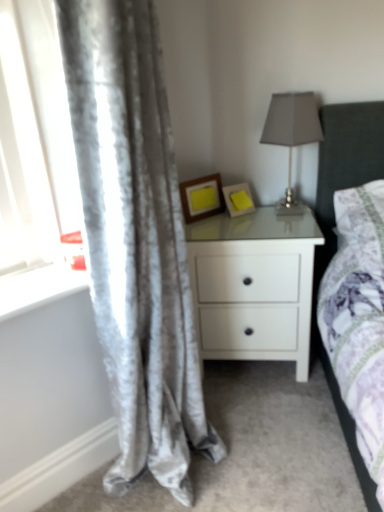
Question: From the image's perspective, is white glossy nightstand at center on white glossy window sill at lower left?

Choices:
 (A) no
 (B) yes

Answer: (A)

Question: Does white glossy nightstand at center have a greater width compared to white glossy window sill at lower left?

Choices:
 (A) no
 (B) yes

Answer: (B)

Question: Is white glossy nightstand at center oriented towards white glossy window sill at lower left?

Choices:
 (A) no
 (B) yes

Answer: (A)

Question: Is white glossy nightstand at center facing away from white glossy window sill at lower left?

Choices:
 (A) no
 (B) yes

Answer: (A)

Question: Is white glossy nightstand at center shorter than white glossy window sill at lower left?

Choices:
 (A) yes
 (B) no

Answer: (B)

Question: Is white glossy nightstand at center with white glossy window sill at lower left?

Choices:
 (A) no
 (B) yes

Answer: (A)

Question: Considering the relative sizes of yellow matte picture frame at upper center, which ranks as the first picture frame in right-to-left order, and white glossy window sill at lower left in the image provided, is yellow matte picture frame at upper center, which ranks as the first picture frame in right-to-left order, thinner than white glossy window sill at lower left?

Choices:
 (A) no
 (B) yes

Answer: (B)

Question: Could you tell me if yellow matte picture frame at upper center, placed as the second picture frame when sorted from left to right, is facing white glossy window sill at lower left?

Choices:
 (A) yes
 (B) no

Answer: (B)

Question: Does yellow matte picture frame at upper center, placed as the second picture frame when sorted from left to right, appear on the right side of white glossy window sill at lower left?

Choices:
 (A) no
 (B) yes

Answer: (B)

Question: From a real-world perspective, is yellow matte picture frame at upper center, which ranks as the first picture frame in right-to-left order, over white glossy window sill at lower left?

Choices:
 (A) yes
 (B) no

Answer: (A)

Question: Considering the relative sizes of yellow matte picture frame at upper center, which ranks as the first picture frame in right-to-left order, and white glossy window sill at lower left in the image provided, is yellow matte picture frame at upper center, which ranks as the first picture frame in right-to-left order, shorter than white glossy window sill at lower left?

Choices:
 (A) no
 (B) yes

Answer: (A)

Question: Is yellow matte picture frame at upper center, which ranks as the first picture frame in right-to-left order, placed right next to white glossy window sill at lower left?

Choices:
 (A) yes
 (B) no

Answer: (B)

Question: Does white glossy window sill at lower left lie in front of white glossy nightstand at center?

Choices:
 (A) yes
 (B) no

Answer: (A)